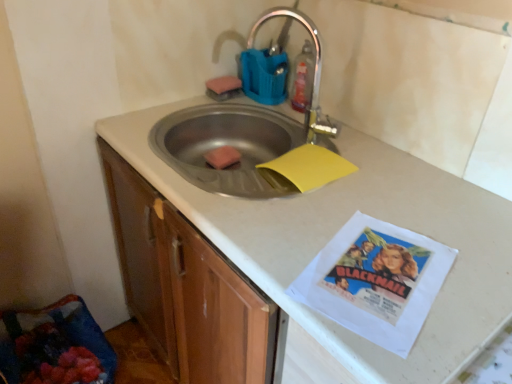
The image size is (512, 384). In order to click on vacant area that is in front of pink sponge at upper center, placed as the second food when sorted from bottom to top in this screenshot , I will do `click(215, 106)`.